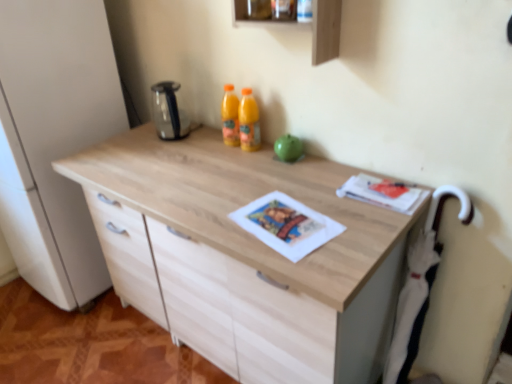
Question: Does wooden frame at upper center, marked as the first shelf in a top-to-bottom arrangement, have a lesser width compared to stainless steel kettle at upper center?

Choices:
 (A) yes
 (B) no

Answer: (A)

Question: Can you confirm if wooden frame at upper center, positioned as the 2th shelf in bottom-to-top order, is wider than stainless steel kettle at upper center?

Choices:
 (A) yes
 (B) no

Answer: (B)

Question: From a real-world perspective, does wooden frame at upper center, positioned as the 2th shelf in bottom-to-top order, stand above stainless steel kettle at upper center?

Choices:
 (A) no
 (B) yes

Answer: (B)

Question: Considering the relative sizes of wooden frame at upper center, positioned as the 2th shelf in bottom-to-top order, and stainless steel kettle at upper center in the image provided, is wooden frame at upper center, positioned as the 2th shelf in bottom-to-top order, taller than stainless steel kettle at upper center?

Choices:
 (A) yes
 (B) no

Answer: (B)

Question: Is wooden frame at upper center, marked as the first shelf in a top-to-bottom arrangement, positioned behind stainless steel kettle at upper center?

Choices:
 (A) no
 (B) yes

Answer: (A)

Question: Is wooden frame at upper center, marked as the first shelf in a top-to-bottom arrangement, positioned far away from stainless steel kettle at upper center?

Choices:
 (A) yes
 (B) no

Answer: (B)

Question: From the image's perspective, is wooden shelf at upper center, the second shelf when ordered from top to bottom, on top of wooden frame at upper center, marked as the first shelf in a top-to-bottom arrangement?

Choices:
 (A) no
 (B) yes

Answer: (A)

Question: From a real-world perspective, is wooden shelf at upper center, the second shelf when ordered from top to bottom, under wooden frame at upper center, marked as the first shelf in a top-to-bottom arrangement?

Choices:
 (A) no
 (B) yes

Answer: (B)

Question: Is wooden frame at upper center, positioned as the 2th shelf in bottom-to-top order, located within wooden shelf at upper center, the second shelf when ordered from top to bottom?

Choices:
 (A) no
 (B) yes

Answer: (B)

Question: Does wooden shelf at upper center, acting as the 1th shelf starting from the bottom, have a smaller size compared to wooden frame at upper center, marked as the first shelf in a top-to-bottom arrangement?

Choices:
 (A) yes
 (B) no

Answer: (B)

Question: Is wooden shelf at upper center, acting as the 1th shelf starting from the bottom, positioned in front of wooden frame at upper center, marked as the first shelf in a top-to-bottom arrangement?

Choices:
 (A) yes
 (B) no

Answer: (A)

Question: Can you confirm if wooden shelf at upper center, the second shelf when ordered from top to bottom, is wider than wooden frame at upper center, marked as the first shelf in a top-to-bottom arrangement?

Choices:
 (A) yes
 (B) no

Answer: (B)

Question: Is stainless steel kettle at upper center bigger than wooden shelf at upper center, the second shelf when ordered from top to bottom?

Choices:
 (A) no
 (B) yes

Answer: (A)